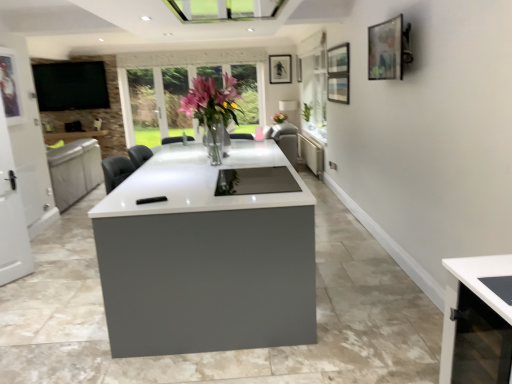
Locate an element on the screen. free space to the right of white glossy door at left is located at coordinates (38, 281).